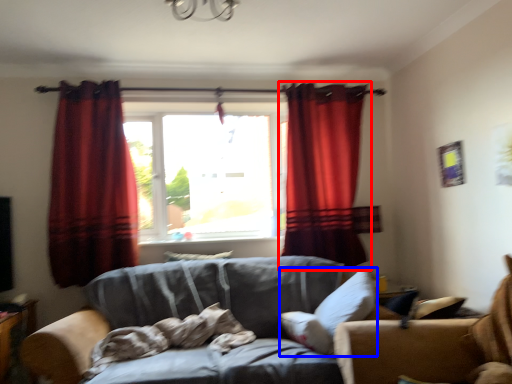
Question: Which point is further to the camera, curtain (highlighted by a red box) or pillow (highlighted by a blue box)?

Choices:
 (A) curtain
 (B) pillow

Answer: (A)